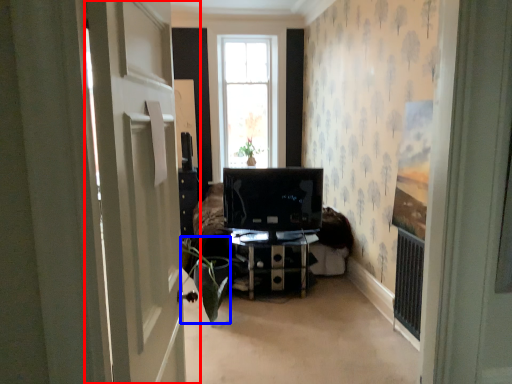
Question: Which point is closer to the camera, door (highlighted by a red box) or plant (highlighted by a blue box)?

Choices:
 (A) door
 (B) plant

Answer: (A)